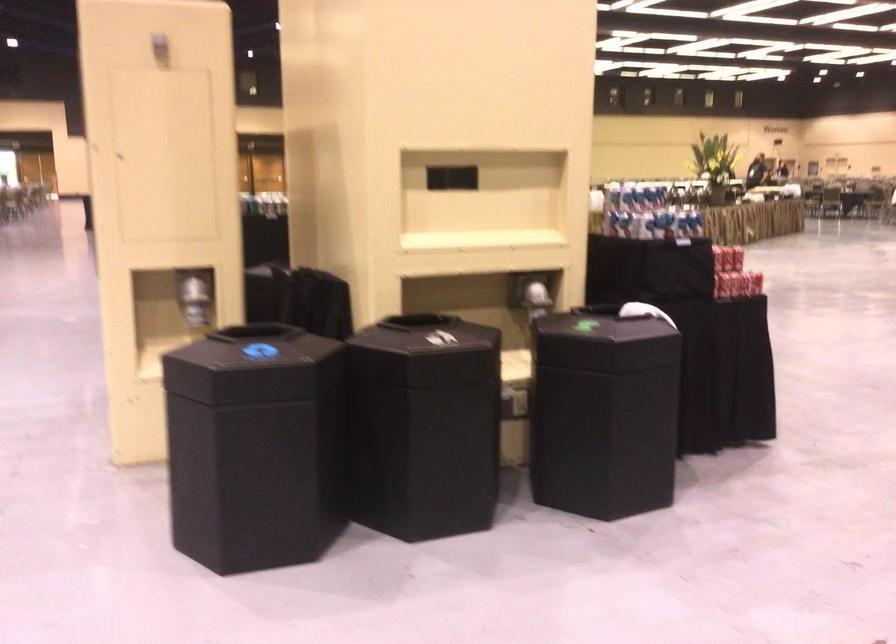
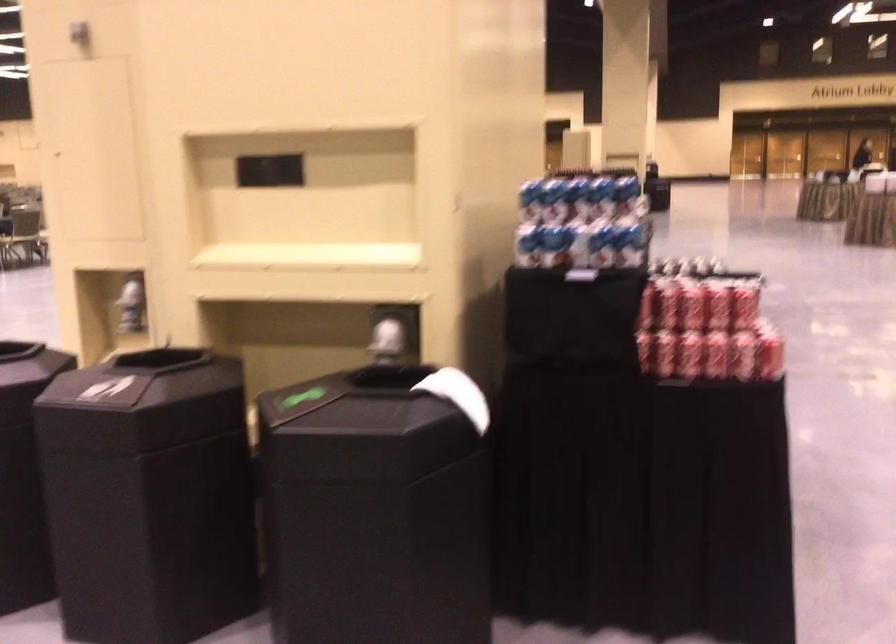
Locate, in the second image, the point that corresponds to pixel 728 283 in the first image.

(664, 353)